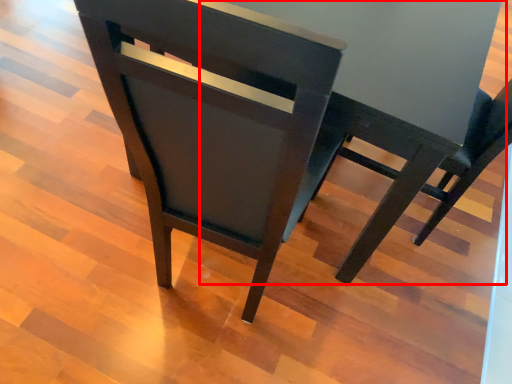
Question: From the image's perspective, what is the correct spatial positioning of round table (annotated by the red box) in reference to chair?

Choices:
 (A) above
 (B) below

Answer: (A)